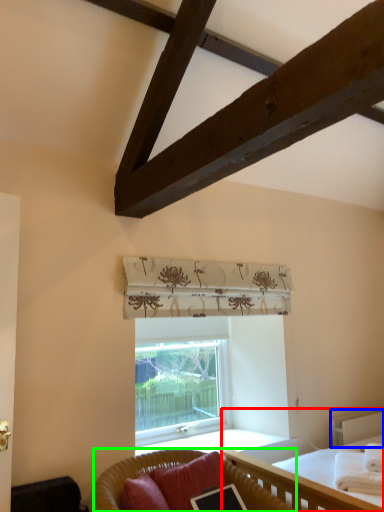
Question: Which is nearer to the bed (highlighted by a red box)? balustrade (highlighted by a blue box) or studio couch (highlighted by a green box).

Choices:
 (A) balustrade
 (B) studio couch

Answer: (B)